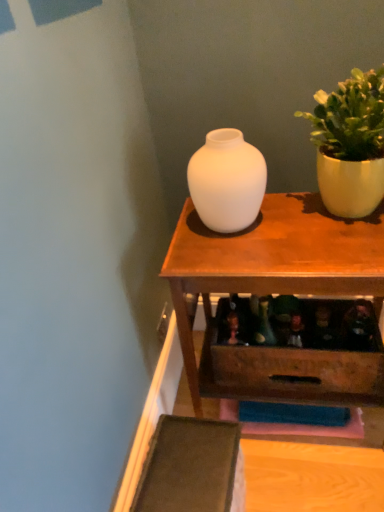
You are a GUI agent. You are given a task and a screenshot of the screen. Output one action in this format:
    pyautogui.click(x=<x>, y=<y>)
    Task: Click on the vacant space in front of matte yellow pot at upper right
    This screenshot has height=512, width=384.
    Given the screenshot: What is the action you would take?
    pyautogui.click(x=338, y=252)